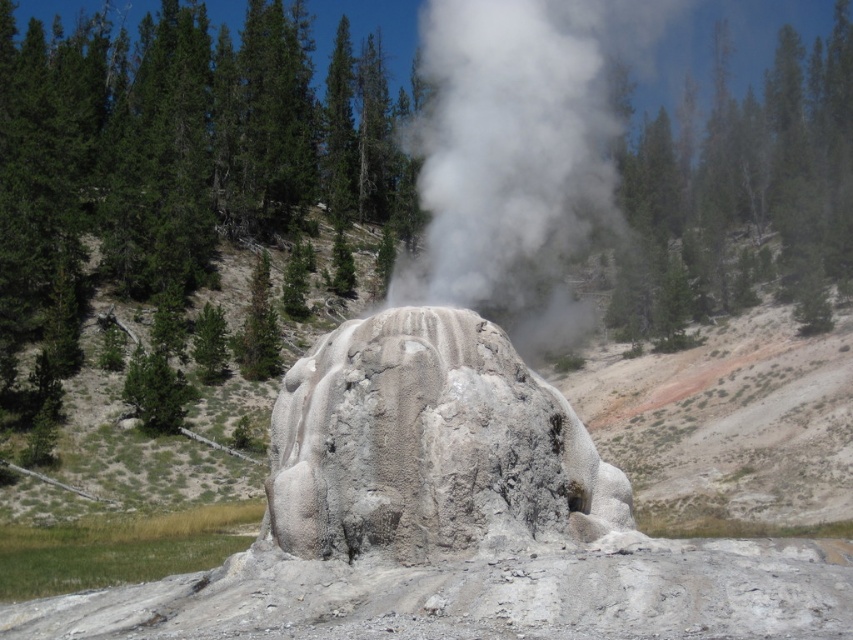
Question: Is white rock formation at center positioned in front of white textured rock at center?

Choices:
 (A) yes
 (B) no

Answer: (B)

Question: Can you confirm if white rock formation at center is positioned to the left of white textured rock at center?

Choices:
 (A) yes
 (B) no

Answer: (B)

Question: Which object is the closest to the white vapor steam at center?

Choices:
 (A) white rock formation at center
 (B) white textured rock at center

Answer: (A)

Question: Can you confirm if white rock formation at center is positioned to the right of white textured rock at center?

Choices:
 (A) no
 (B) yes

Answer: (B)

Question: Which point is closer to the camera taking this photo?

Choices:
 (A) (570, 58)
 (B) (746, 476)

Answer: (A)

Question: Which point appears farthest from the camera in this image?

Choices:
 (A) (387, 406)
 (B) (480, 172)

Answer: (B)